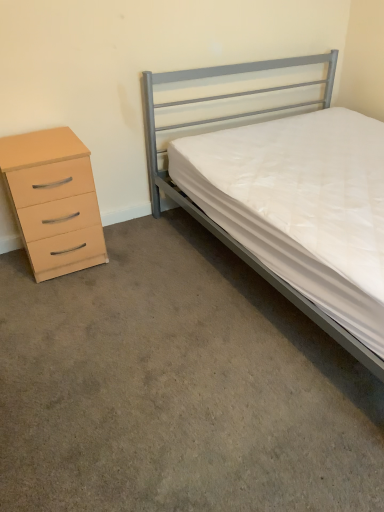
The width and height of the screenshot is (384, 512). I want to click on empty space that is ontop of carpet at lower left (from a real-world perspective), so click(158, 353).